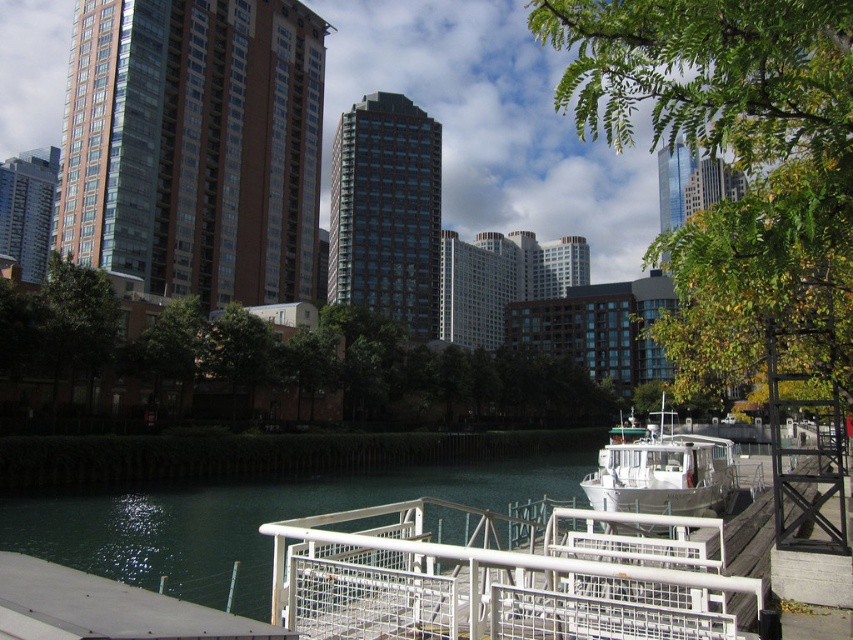
You are a photographer trying to capture the white matte boat at center without any obstructions. Based on the scene, is the green leafy tree at upper right blocking your view of the boat?

The green leafy tree at upper right is in front of the white matte boat at center, so it would block the view of the boat.